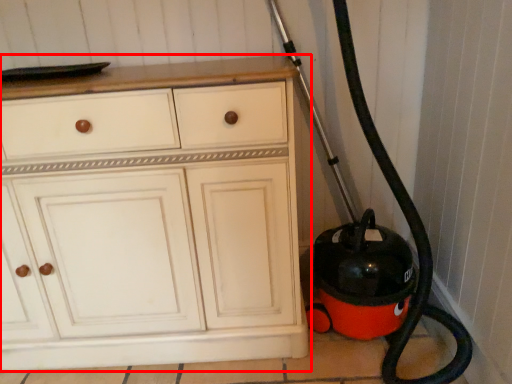
Question: From the image's perspective, what is the correct spatial relationship of chest of drawers (annotated by the red box) in relation to garden hose?

Choices:
 (A) above
 (B) below

Answer: (B)